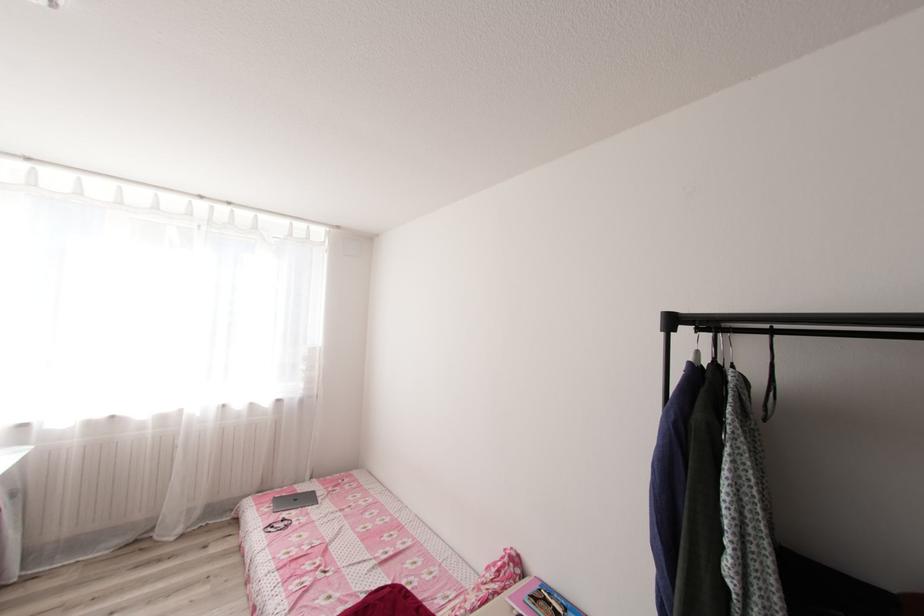
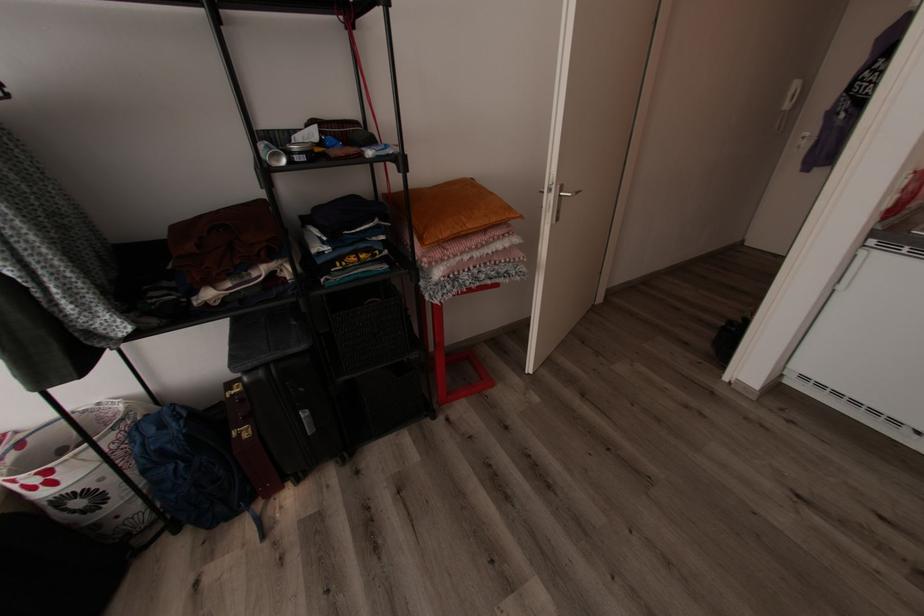
Based on the continuous images, in which direction is the camera rotating?

The rotation direction of the camera is right-down.